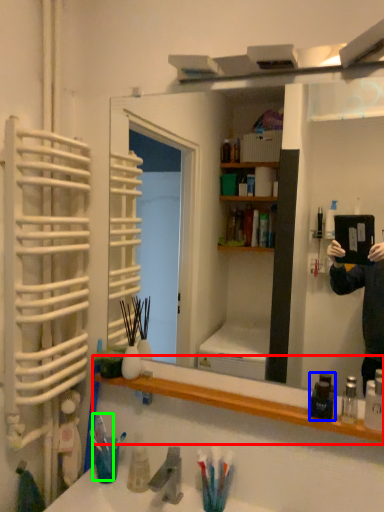
Question: Considering the real-world distances, which object is farthest from bookshelf (highlighted by a red box)? mouthwash (highlighted by a blue box) or toothbrush (highlighted by a green box)?

Choices:
 (A) mouthwash
 (B) toothbrush

Answer: (B)